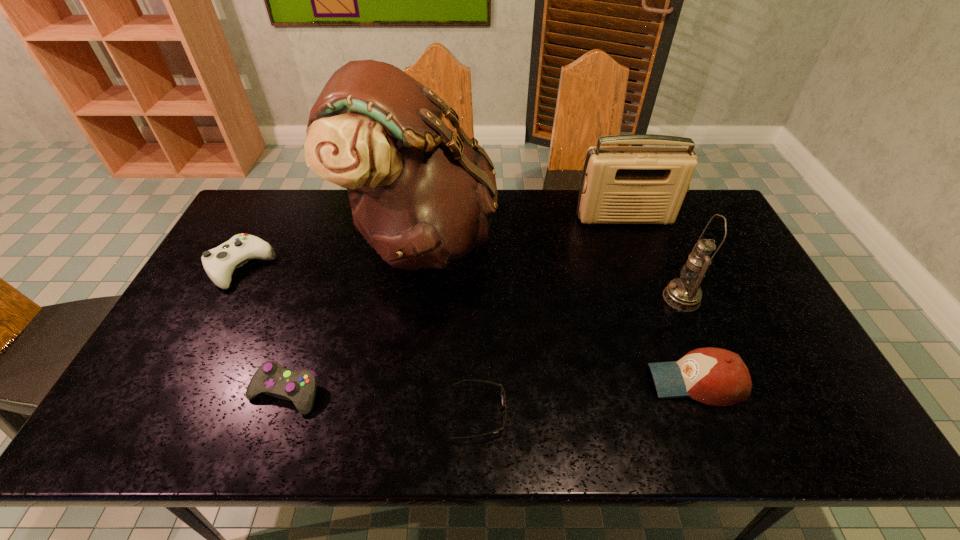
The image size is (960, 540). Find the location of `object identified as the closest to the sunglasses`. object identified as the closest to the sunglasses is located at coordinates (422, 196).

You are a GUI agent. You are given a task and a screenshot of the screen. Output one action in this format:
    pyautogui.click(x=<x>, y=<y>)
    Task: Click on the object that is the third nearest to the fourth shortest object
    This screenshot has height=540, width=960.
    Given the screenshot: What is the action you would take?
    pyautogui.click(x=422, y=196)

This screenshot has height=540, width=960. What are the coordinates of `blank space that satisfies the following two spatial constraints: 1. on the front-facing side of the radio receiver; 2. on the front-facing side of the sunglasses` in the screenshot? It's located at (696, 413).

Locate an element on the screen. The height and width of the screenshot is (540, 960). free space in the image that satisfies the following two spatial constraints: 1. on the back side of the oil lamp; 2. at the front of the satchel with buckles is located at coordinates (657, 238).

Where is `vacant region that satisfies the following two spatial constraints: 1. at the front of the tallest object with buckles; 2. on the back side of the oil lamp`? The height and width of the screenshot is (540, 960). vacant region that satisfies the following two spatial constraints: 1. at the front of the tallest object with buckles; 2. on the back side of the oil lamp is located at coordinates (414, 298).